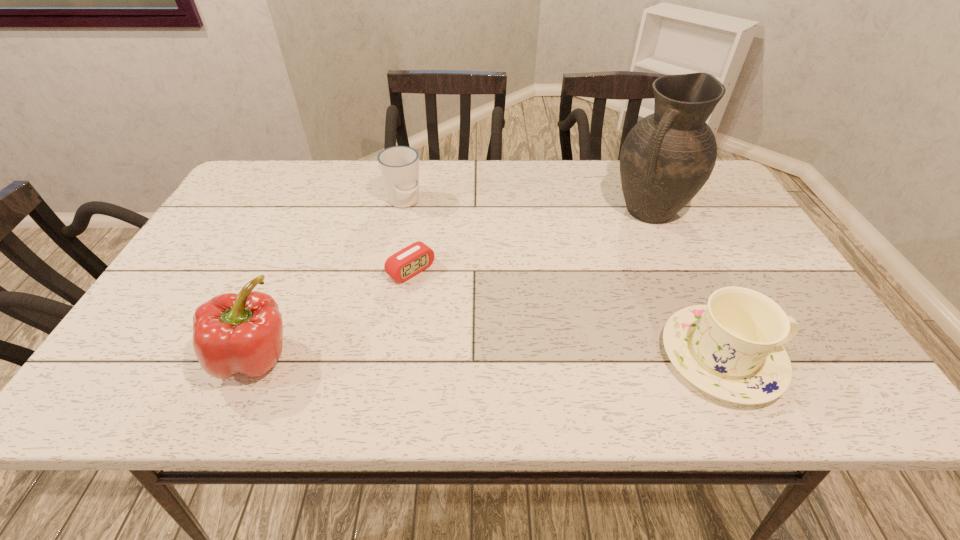
What are the coordinates of `vacant space located on the front-facing side of the shortest object` in the screenshot? It's located at (468, 318).

Find the location of a particular element. vacant position located 0.200m with a handle on the side of the cup is located at coordinates coord(427,259).

Find the location of a particular element. Image resolution: width=960 pixels, height=540 pixels. free point located 0.130m with a handle on the side of the cup is located at coordinates (420, 242).

Where is `vacant point located with a handle on the side of the cup`? The width and height of the screenshot is (960, 540). vacant point located with a handle on the side of the cup is located at coordinates (449, 309).

Find the location of a particular element. This screenshot has width=960, height=540. free space located 0.350m on the side of the tallest object with the handle is located at coordinates (565, 307).

The image size is (960, 540). I want to click on free space located 0.380m on the side of the tallest object with the handle, so click(559, 315).

Find the location of `vacant space located on the side of the tallest object with the handle`. vacant space located on the side of the tallest object with the handle is located at coordinates (591, 278).

The image size is (960, 540). I want to click on cup present at the far edge, so click(x=399, y=165).

Where is `pitcher situated at the far edge`? The width and height of the screenshot is (960, 540). pitcher situated at the far edge is located at coordinates (667, 157).

At what (x,y) coordinates should I click in order to perform the action: click on pepper at the near edge. Please return your answer as a coordinate pair (x, y). The image size is (960, 540). Looking at the image, I should click on (242, 333).